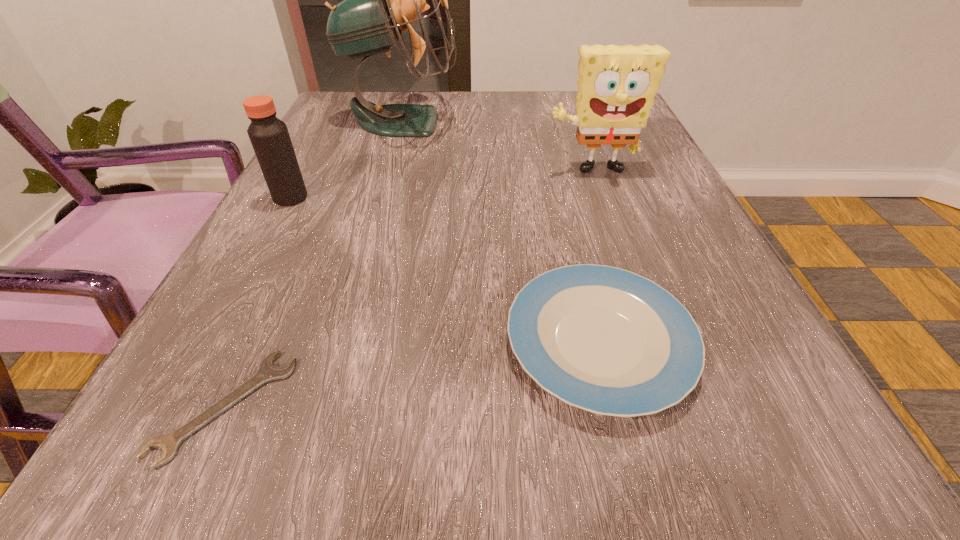
Find the location of a particular element. The width and height of the screenshot is (960, 540). the tallest object is located at coordinates (380, 0).

At what (x,y) coordinates should I click in order to perform the action: click on the farthest object. Please return your answer as a coordinate pair (x, y). The height and width of the screenshot is (540, 960). Looking at the image, I should click on (380, 0).

Identify the location of the second farthest object. (617, 84).

The image size is (960, 540). Identify the location of sponge. (617, 84).

The image size is (960, 540). What are the coordinates of `the third tallest object` in the screenshot? It's located at (269, 136).

Identify the location of vinegar. The width and height of the screenshot is (960, 540). (269, 136).

Find the location of a particular element. plate is located at coordinates (606, 340).

Find the location of `wrench`. wrench is located at coordinates (170, 442).

Find the location of a particular element. The image size is (960, 540). vacant space situated on the front-facing side of the fan for air flow is located at coordinates (587, 121).

The image size is (960, 540). In order to click on free space located on the face of the fourth shortest object in this screenshot , I will do `click(636, 300)`.